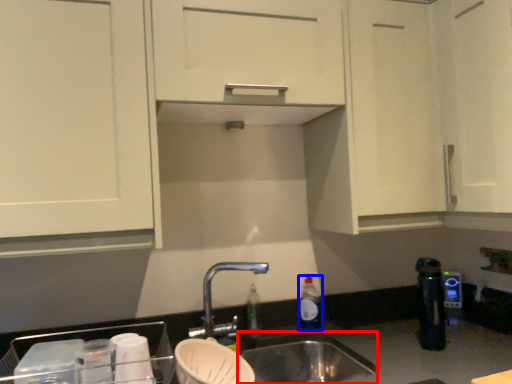
Question: Which object is closer to the camera taking this photo, sink (highlighted by a red box) or bottle (highlighted by a blue box)?

Choices:
 (A) sink
 (B) bottle

Answer: (A)